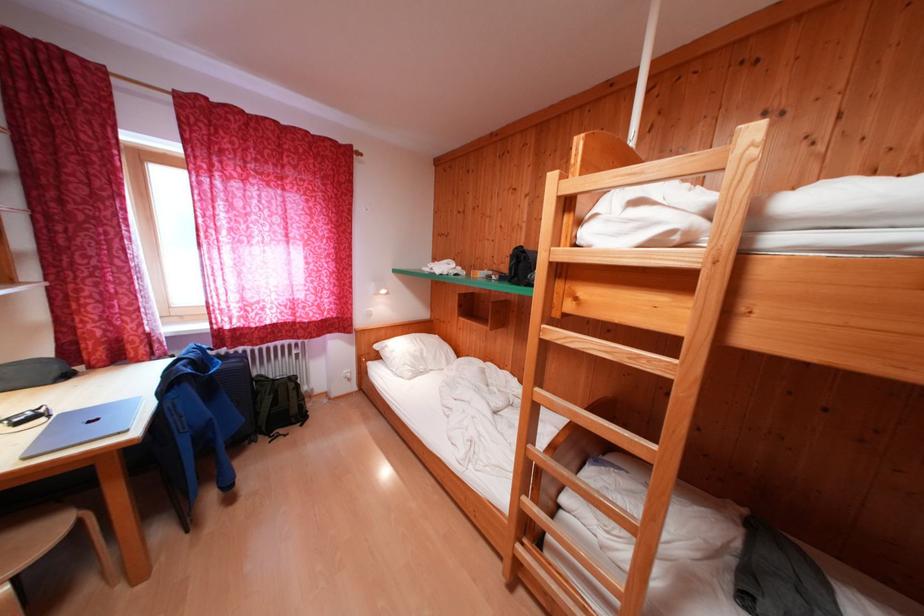
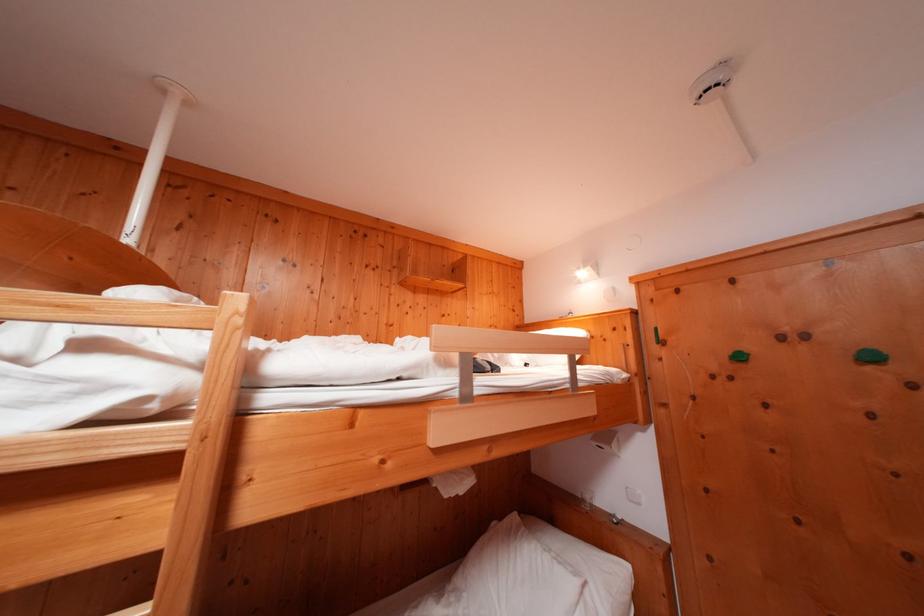
Question: The camera is either moving clockwise (left) or counter-clockwise (right) around the object. The first image is from the beginning of the video and the second image is from the end. Is the camera moving left or right when shooting the video?

Choices:
 (A) Left
 (B) Right

Answer: (A)